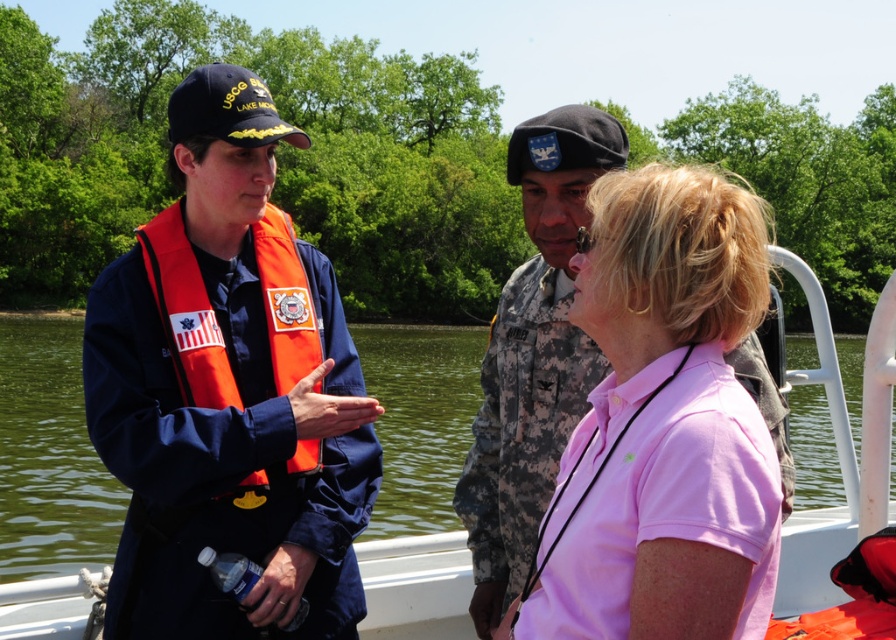
You are standing on the boat and want to move from the point closer to you to the point further away. Which path should you take? The points are labeled as point 1 at [243,115] and point 2 at [718,304]. Please describe the direction you need to move in terms of left, right, forward, or backward relative to the boat.

You should move towards the point 2 at [718,304] by going backward and to the right. Since point 1 is closer to you, moving backward will take you away from the boat towards the direction of point 2, which is positioned to the right side of the boat.

You are on a boat and need to hand a document to both the person in the navy blue uniform at center and the person in the pink cotton polo shirt at center. If you want to hand the document to the taller individual first, which person should you approach first?

The navy blue uniform at center is much taller than the pink cotton polo shirt at center, so you should approach the navy blue uniform at center first.

You are standing on the boat and need to locate the orange fabric life jacket at left and the pink cotton polo shirt at center. According to the scene, which object is positioned more to the left?

The orange fabric life jacket at left is positioned more to the left than the pink cotton polo shirt at center.